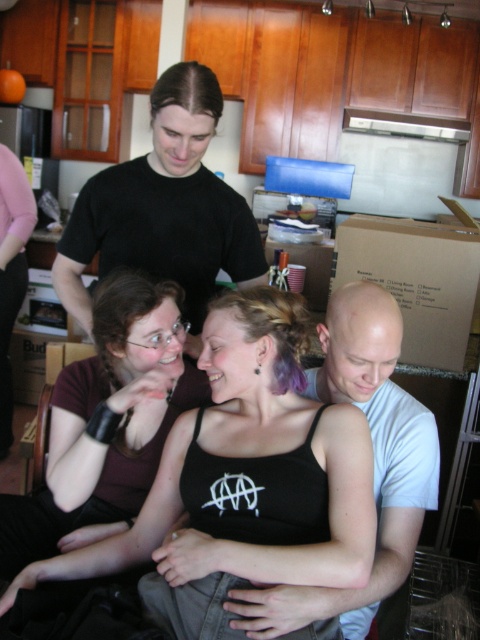
You are a photographer trying to capture a clear shot of the bald head at center without the black tank top at center blocking it. Can you adjust your position to do so?

The black tank top at center is in front of the bald head at center, so moving your camera position slightly behind the bald head at center or angling the shot downward might allow you to capture the bald head without obstruction.

You are trying to decide which clothing item to take for a photoshoot. You have the matte black tank top at center and the black matte shirt at upper center. Which one is shorter in height?

The matte black tank top at center has a lesser height compared to the black matte shirt at upper center, so the matte black tank top at center is shorter.